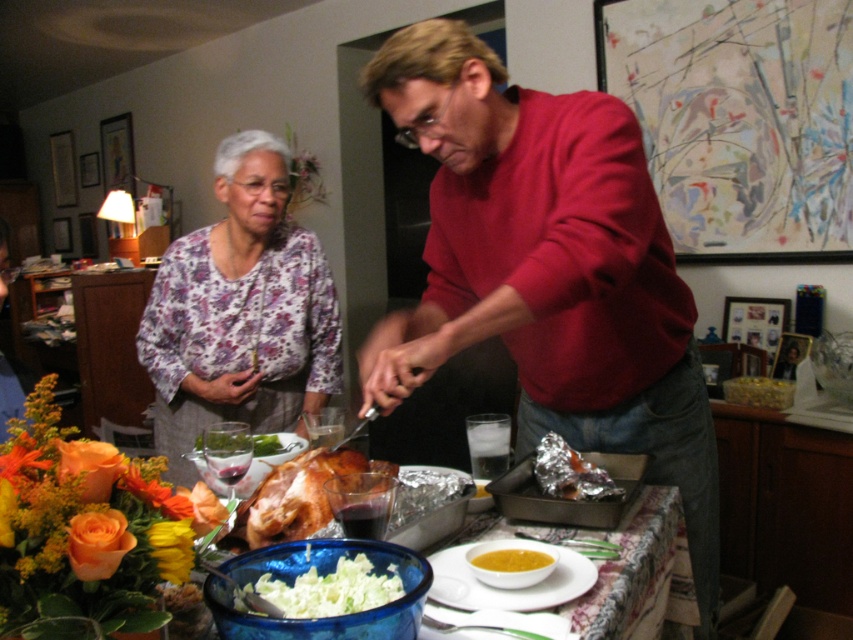
You are standing at the center of the dining room table and want to reach both the roasted turkey and the bowl of soup. The roasted turkey is located at point (512, 257) and the bowl of soup is at point (593, 474). Which one is closer to you?

Point (512, 257) is behind point (593, 474), so the bowl of soup at point (593, 474) is closer to you.